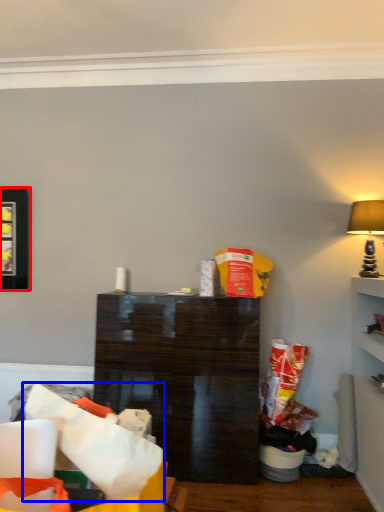
Question: Which object appears closest to the camera in this image, picture frame (highlighted by a red box) or paper bag (highlighted by a blue box)?

Choices:
 (A) picture frame
 (B) paper bag

Answer: (B)